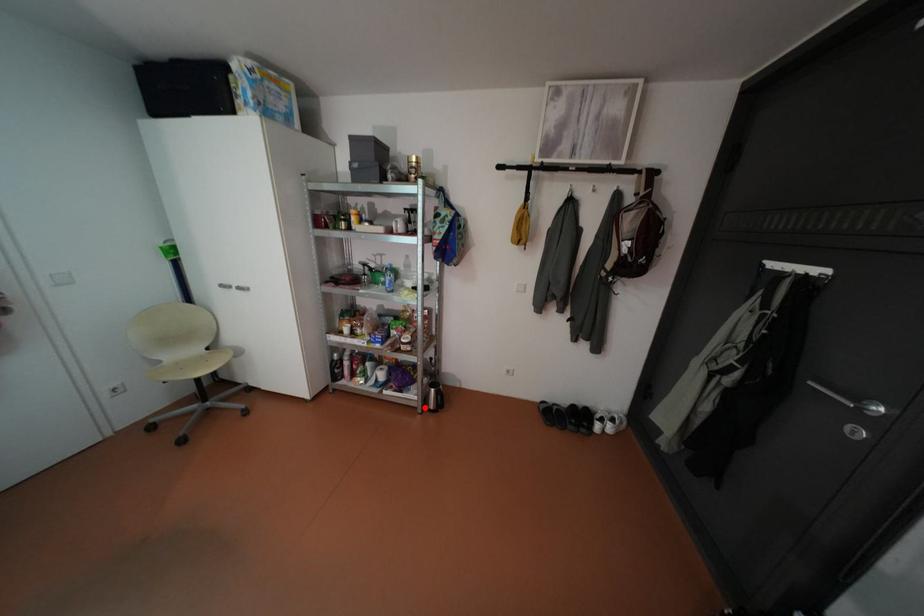
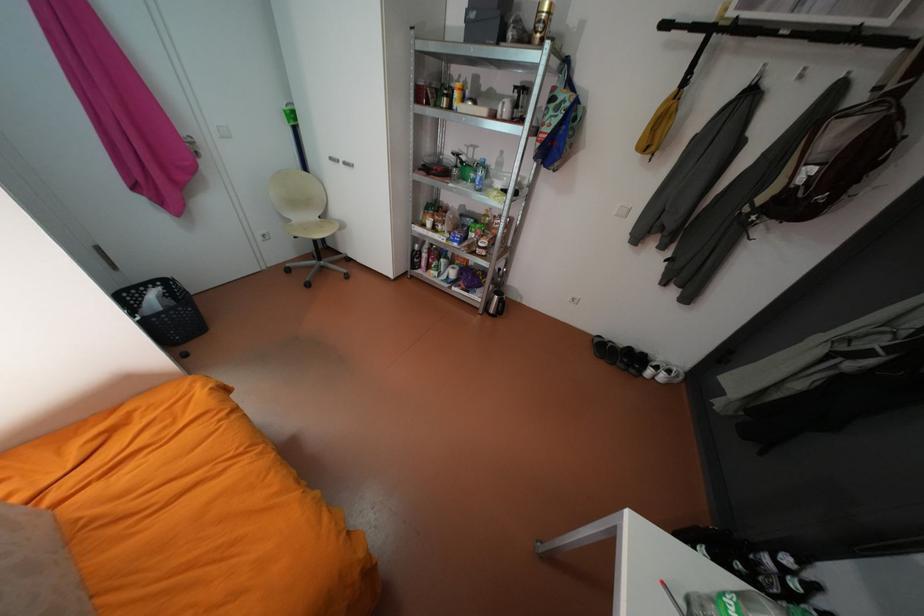
Where in the second image is the point corresponding to the highlighted location from the first image?

(487, 308)